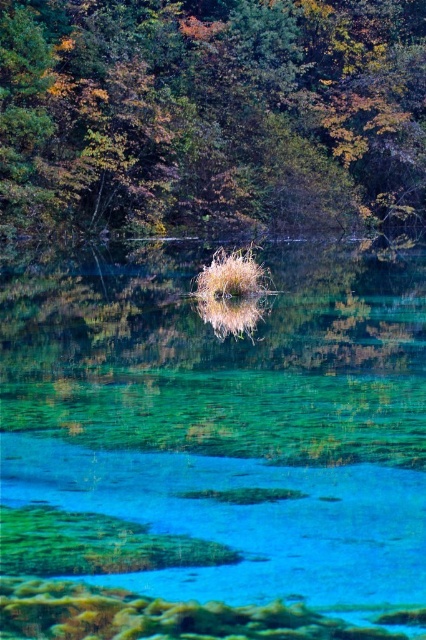
Question: Which is farther from the dry grass at center?

Choices:
 (A) clear glass water at center
 (B) green leafy tree at upper center

Answer: (B)

Question: Which is nearer to the green leafy tree at upper center?

Choices:
 (A) dry grass at center
 (B) clear glass water at center

Answer: (B)

Question: In this image, where is green leafy tree at upper center located relative to dry grass at center?

Choices:
 (A) above
 (B) below

Answer: (A)

Question: Can you confirm if clear glass water at center is positioned above green leafy tree at upper center?

Choices:
 (A) no
 (B) yes

Answer: (A)

Question: Which point is closer to the camera?

Choices:
 (A) (371, 358)
 (B) (230, 257)

Answer: (A)

Question: Is green leafy tree at upper center closer to camera compared to dry grass at center?

Choices:
 (A) yes
 (B) no

Answer: (B)